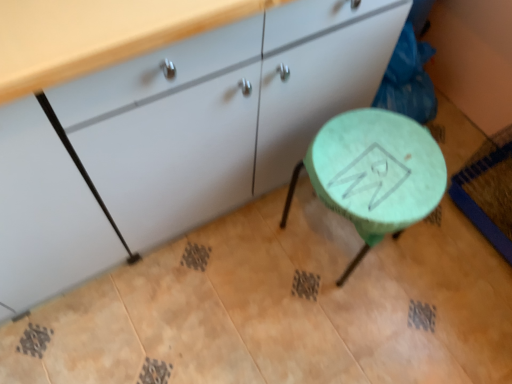
The image size is (512, 384). I want to click on spots to the right of green matte stool at center, so click(x=437, y=271).